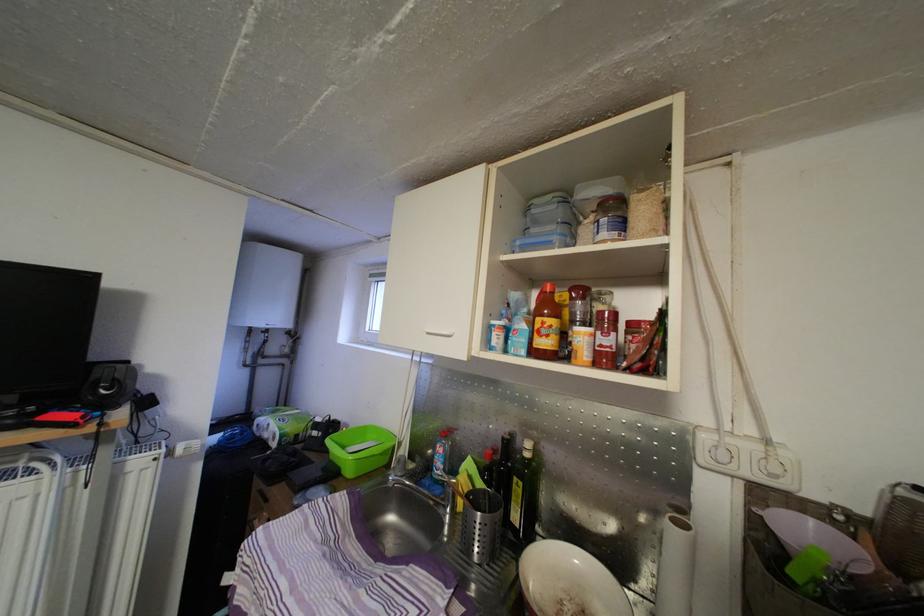
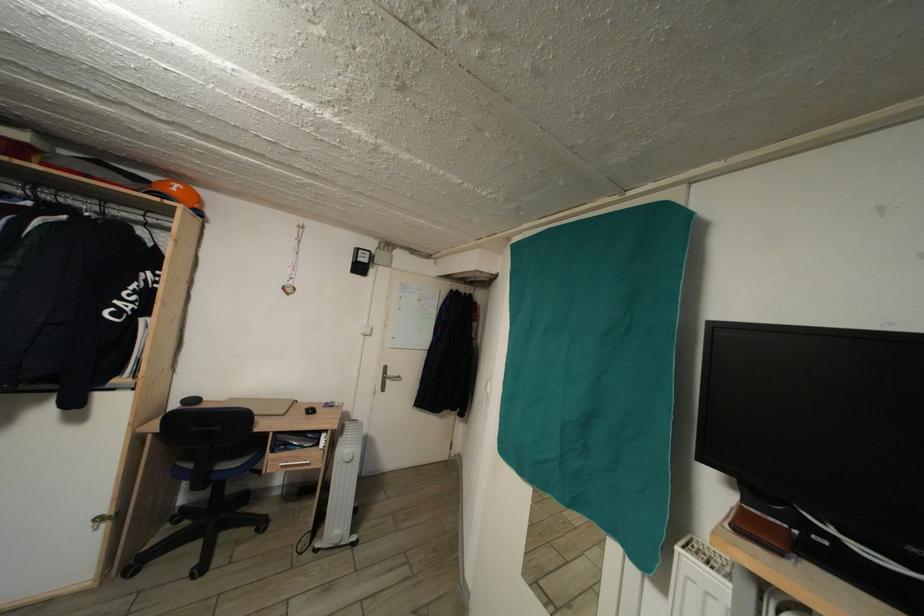
Question: The images are taken continuously from a first-person perspective. In which direction is your viewpoint rotating?

Choices:
 (A) Left
 (B) Right
 (C) Up
 (D) Down

Answer: (A)